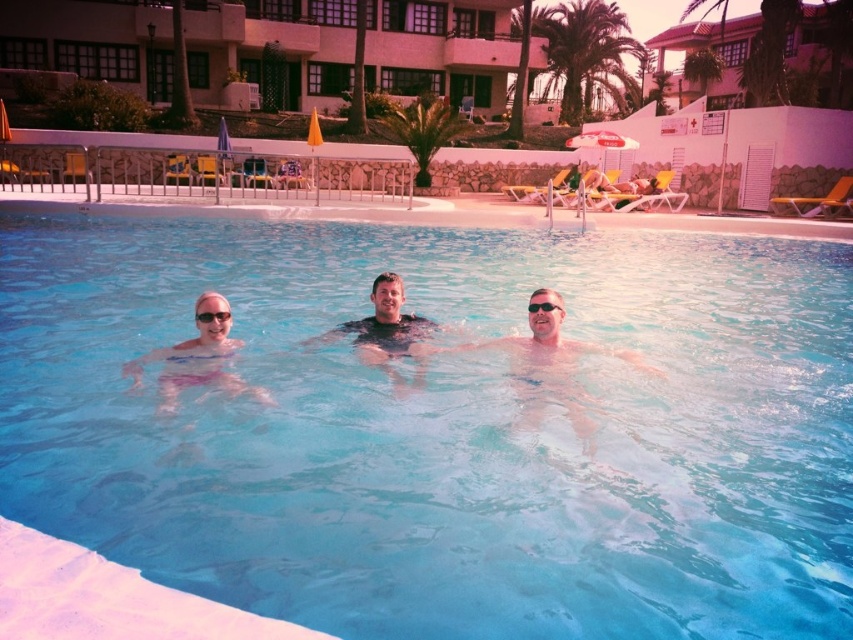
Is green leafy palm tree at upper center smaller than clear plastic goggles at center?

Actually, green leafy palm tree at upper center might be larger than clear plastic goggles at center.

Between point (596, 67) and point (199, 320), which one is positioned in front?

Point (199, 320)

Who is more forward, (589, 77) or (218, 314)?

Positioned in front is point (218, 314).

This screenshot has height=640, width=853. I want to click on green leafy palm tree at upper center, so click(587, 54).

Who is positioned more to the left, smooth black swimwear at center or clear plastic goggles at center?

clear plastic goggles at center

Who is more distant from viewer, (370, 296) or (225, 316)?

The point (370, 296) is behind.

Identify the location of smooth black swimwear at center. (383, 326).

Which of these two, pink fabric at center or clear plastic goggles at center, stands shorter?

With less height is clear plastic goggles at center.

Is pink fabric at center closer to camera compared to clear plastic goggles at center?

Yes.

Where is `pink fabric at center`? This screenshot has height=640, width=853. pink fabric at center is located at coordinates (195, 365).